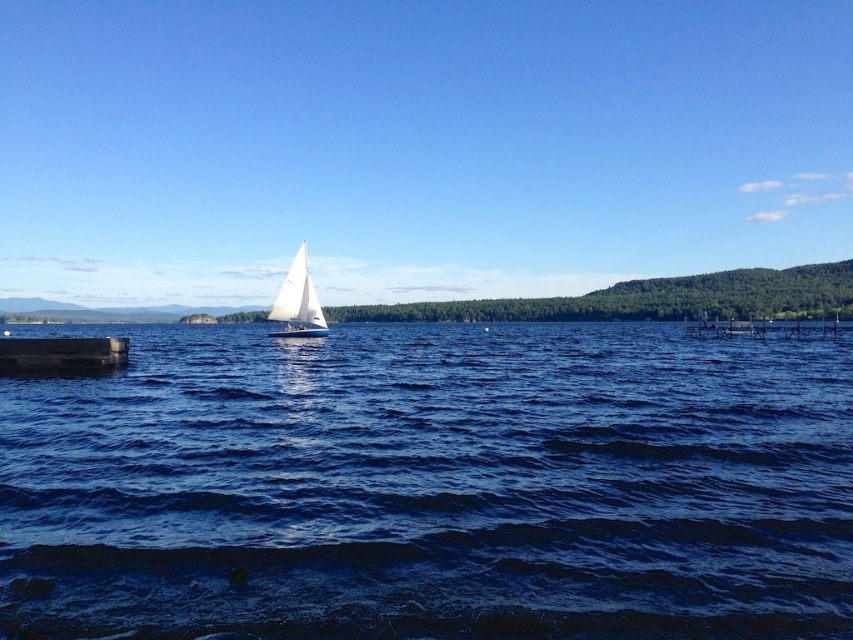
Question: Which of these objects is positioned closest to the blue water at center?

Choices:
 (A) dark gray concrete dock at lower left
 (B) white matte sailboat at center

Answer: (B)

Question: Which point is farther to the camera?

Choices:
 (A) (322, 573)
 (B) (303, 332)

Answer: (B)

Question: Among these objects, which one is nearest to the camera?

Choices:
 (A) dark gray concrete dock at lower left
 (B) white matte sailboat at center
 (C) blue water at center

Answer: (C)

Question: Does blue water at center lie in front of white matte sailboat at center?

Choices:
 (A) no
 (B) yes

Answer: (B)

Question: Is blue water at center smaller than white matte sailboat at center?

Choices:
 (A) yes
 (B) no

Answer: (B)

Question: Does blue water at center lie in front of white matte sailboat at center?

Choices:
 (A) yes
 (B) no

Answer: (A)